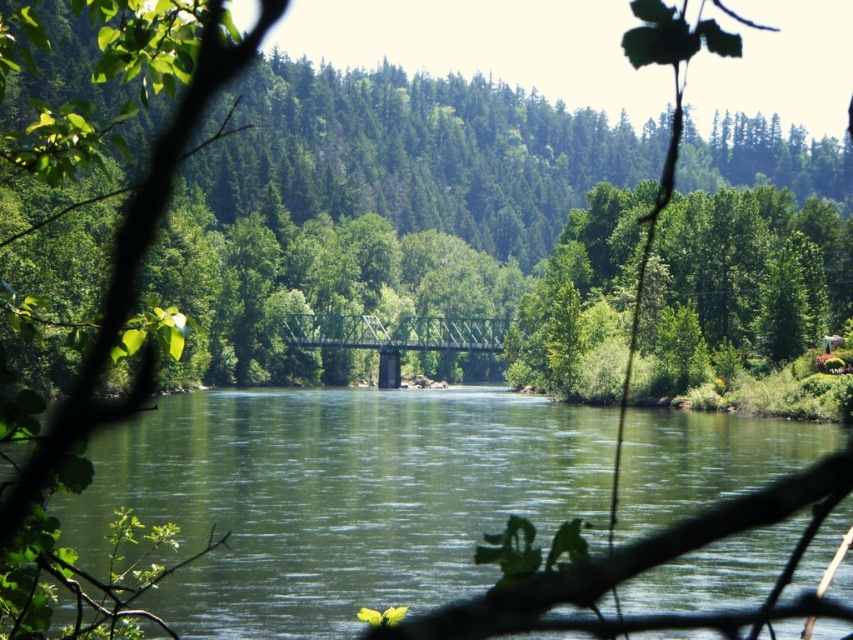
Describe the element at coordinates (421, 154) in the screenshot. The height and width of the screenshot is (640, 853). I see `green matte tree at center` at that location.

Who is taller, green matte tree at center or green metallic bridge at center?

green matte tree at center

Between point (347, 90) and point (325, 337), which one is positioned in front?

Point (325, 337)

The image size is (853, 640). In order to click on green matte tree at center in this screenshot , I will do `click(421, 154)`.

Is green smooth water at center to the left of green matte tree at center from the viewer's perspective?

Correct, you'll find green smooth water at center to the left of green matte tree at center.

Is point (82, 554) farther from camera compared to point (585, 113)?

No, it is in front of (585, 113).

Identify the location of green smooth water at center. The image size is (853, 640). (337, 497).

Is green matte tree at center above green leafy tree at center?

Yes.

At what (x,y) coordinates should I click in order to perform the action: click on green matte tree at center. Please return your answer as a coordinate pair (x, y). Looking at the image, I should click on (421, 154).